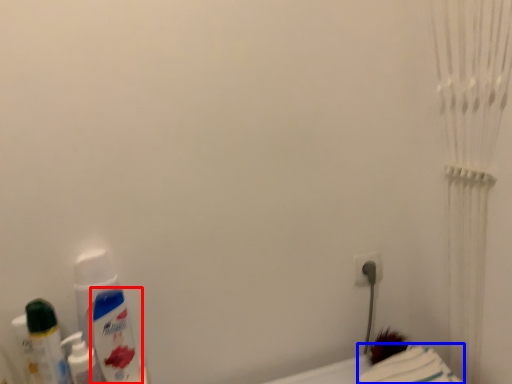
Question: Which point is further to the camera, mouthwash (highlighted by a red box) or sheet (highlighted by a blue box)?

Choices:
 (A) mouthwash
 (B) sheet

Answer: (A)